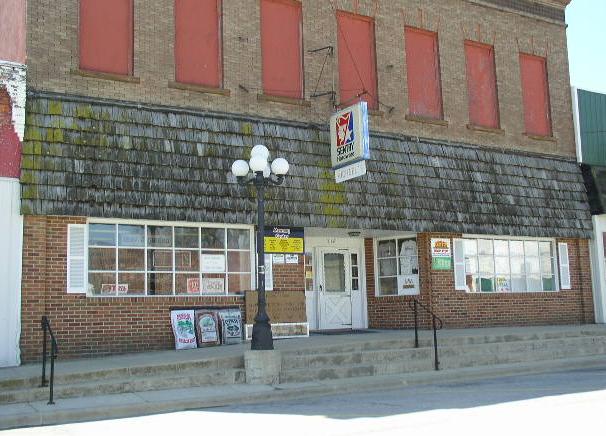
Where can what you would hold onto to help you walk up and down the stairs be observed in this image? Your answer should be formatted as a list of tuples, i.e. [(x1, y1), (x2, y2), ...], where each tuple contains the x and y coordinates of a point satisfying the conditions above.

[(431, 315), (51, 339)]